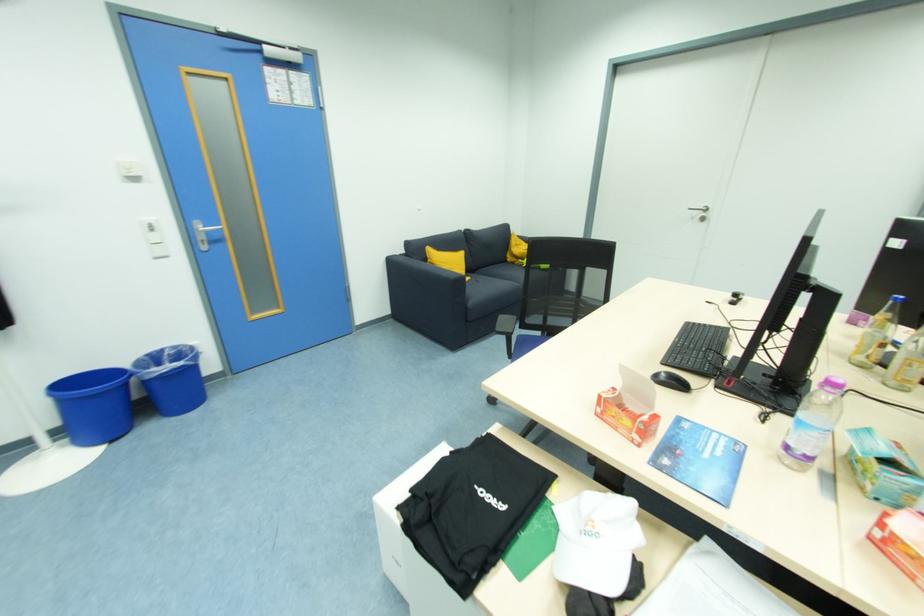
Where would you rest the sofa armrest? Please return your answer as a coordinate pair (x, y).

(421, 283)